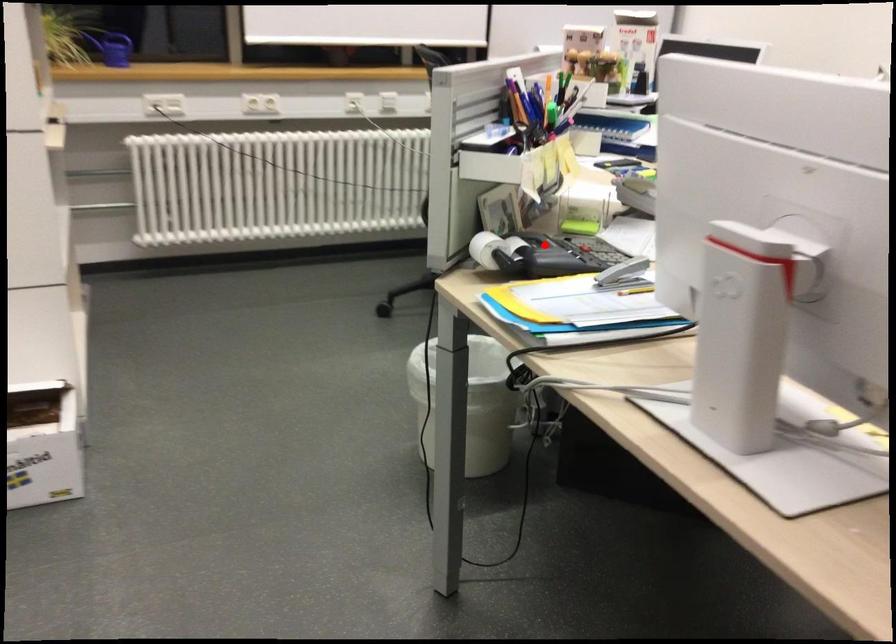
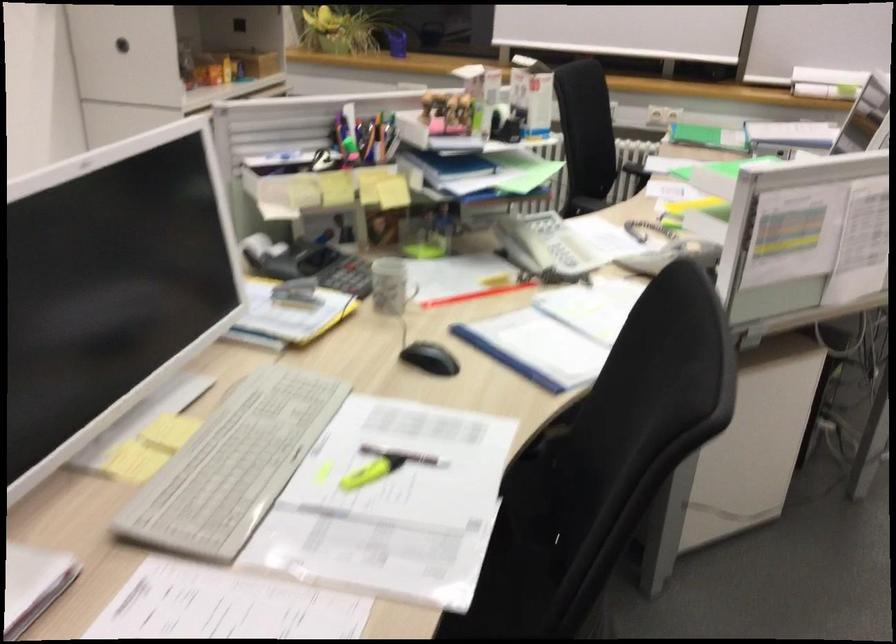
Question: I am providing you with two images of the same scene from different viewpoints. A red point is shown in image1. For the corresponding object point in image2, is it positioned nearer or farther from the camera?

Choices:
 (A) Nearer
 (B) Farther

Answer: (B)